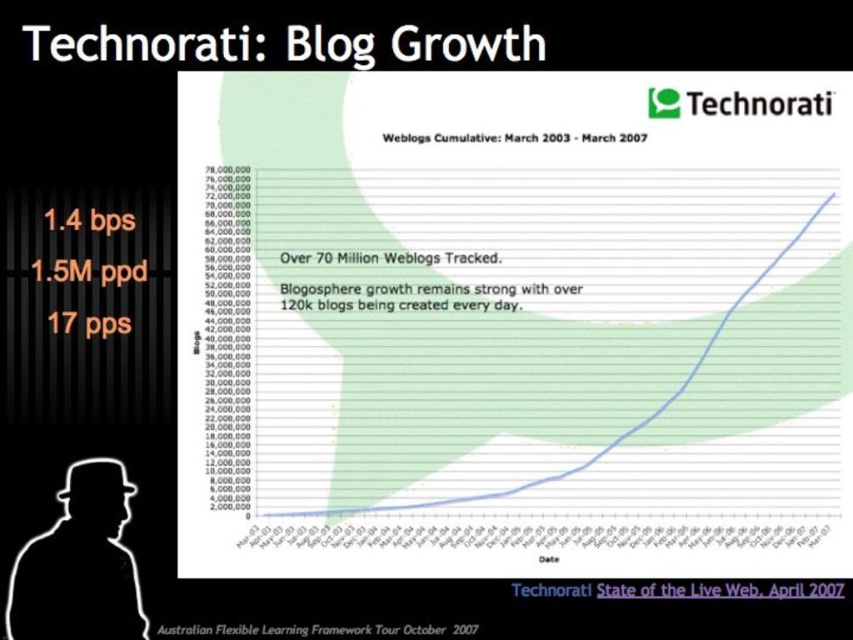
In the scene shown: You are preparing a presentation and want to ensure that the text on your slides is readable. You have two text elements on the slide, the black text at upper center and the white text at upper center. Based on their sizes, which one is more likely to be the main title of the slide?

The black text at upper center is more likely to be the main title because its width is larger than the white text at upper center, indicating it holds more importance.

You are preparing a presentation and need to check the layout of your slide. You have a white paper at center and an orange text at left. Which object is shorter in height?

The white paper at center is not as tall as the orange text at left, so the white paper at center is shorter in height.